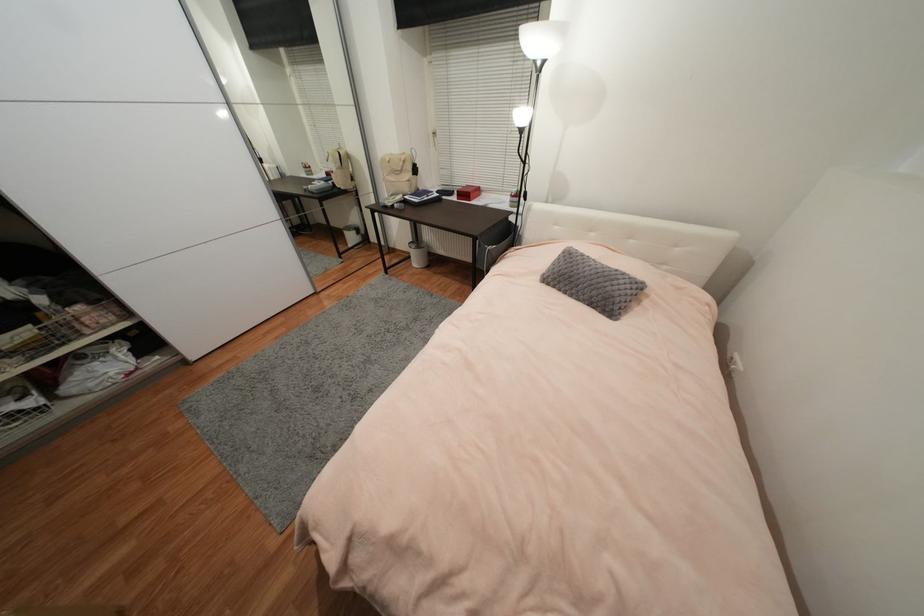
Where is `red box`? red box is located at coordinates pyautogui.click(x=468, y=192).